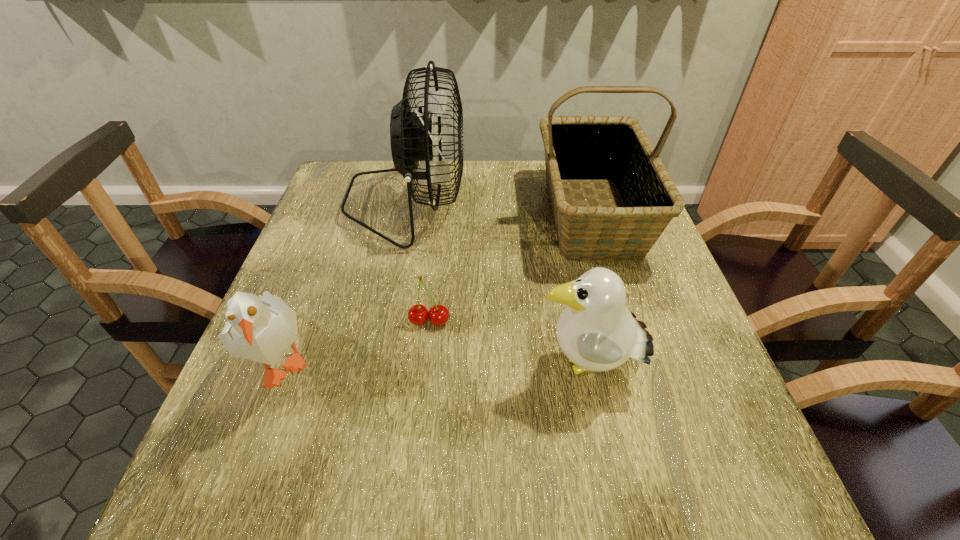
This screenshot has height=540, width=960. Identify the location of vacant space located 0.100m on the beak of the right gull. pyautogui.click(x=482, y=368).

Where is `free space located with the stems of the cherry pointing upwards`? This screenshot has height=540, width=960. free space located with the stems of the cherry pointing upwards is located at coordinates (413, 476).

You are a GUI agent. You are given a task and a screenshot of the screen. Output one action in this format:
    pyautogui.click(x=<x>, y=<y>)
    Task: Click on the fan that is at the far edge
    
    Given the screenshot: What is the action you would take?
    pyautogui.click(x=412, y=138)

You are a GUI agent. You are given a task and a screenshot of the screen. Output one action in this format:
    pyautogui.click(x=<x>, y=<y>)
    Task: Click on the basket situated at the far edge
    This screenshot has width=960, height=540.
    Given the screenshot: What is the action you would take?
    pyautogui.click(x=578, y=149)

At what (x,y) coordinates should I click in order to perform the action: click on fan located in the left edge section of the desktop. Please return your answer as a coordinate pair (x, y). This screenshot has height=540, width=960. Looking at the image, I should click on (412, 138).

The image size is (960, 540). I want to click on gull at the left edge, so click(261, 329).

Identify the location of basket situated at the right edge. coord(578,149).

The image size is (960, 540). Identify the location of gull that is at the right edge. point(596,331).

Find the location of `object positioned at the far left corner`. object positioned at the far left corner is located at coordinates (412, 138).

Where is `object that is positioned at the far right corner`? object that is positioned at the far right corner is located at coordinates 578,149.